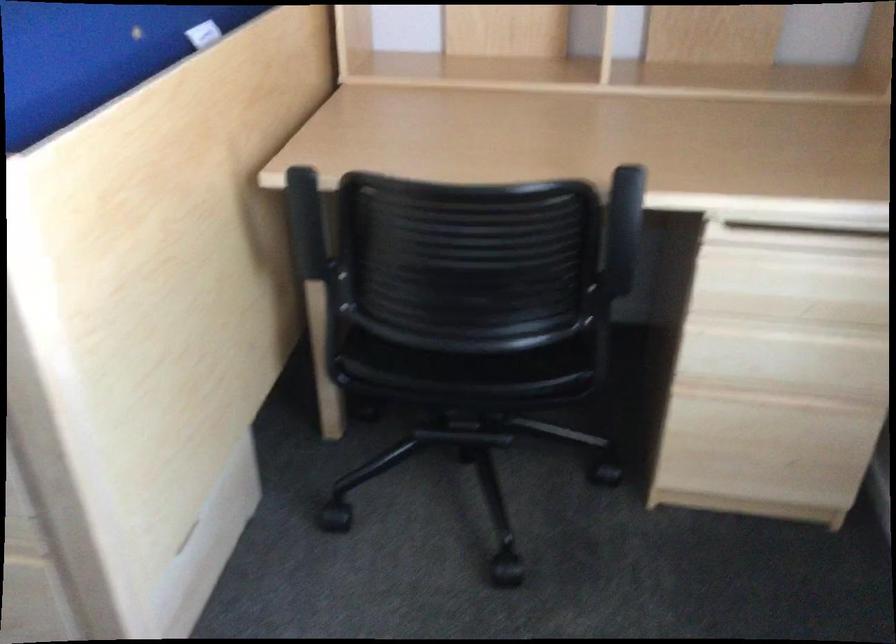
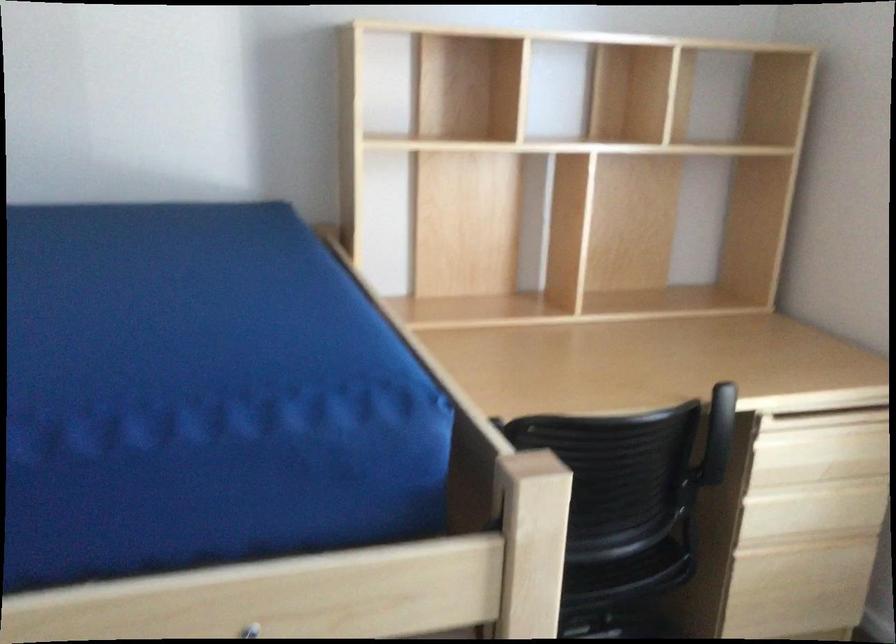
Question: How did the camera likely rotate?

Choices:
 (A) Left
 (B) Right
 (C) Up
 (D) Down

Answer: (B)